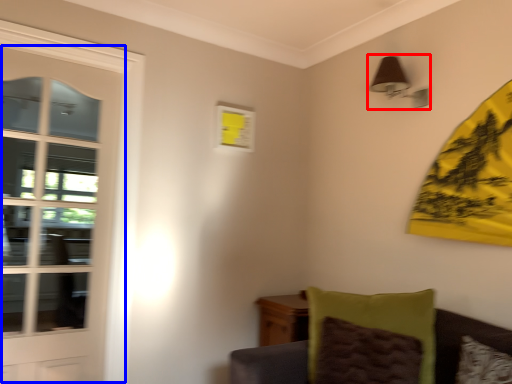
Question: Among these objects, which one is farthest to the camera, light fixture (highlighted by a red box) or door (highlighted by a blue box)?

Choices:
 (A) light fixture
 (B) door

Answer: (A)